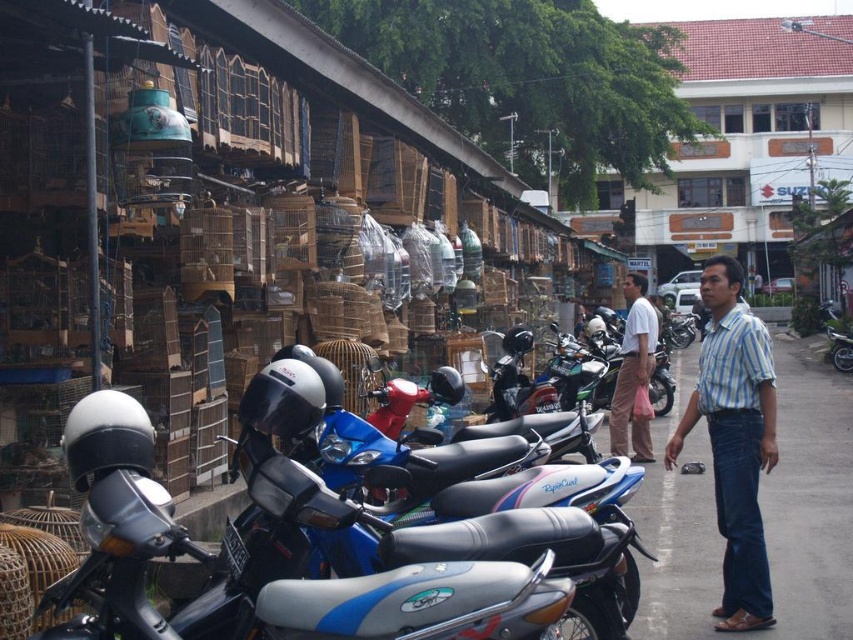
Question: Can you confirm if blue striped shirt at center is wider than white shirt at center?

Choices:
 (A) no
 (B) yes

Answer: (B)

Question: Which point appears closest to the camera in this image?

Choices:
 (A) (750, 342)
 (B) (641, 276)

Answer: (A)

Question: Is blue striped shirt at center in front of white shirt at center?

Choices:
 (A) no
 (B) yes

Answer: (B)

Question: Which of the following is the farthest from the observer?

Choices:
 (A) blue striped shirt at center
 (B) white shirt at center

Answer: (B)

Question: Does blue striped shirt at center appear over white shirt at center?

Choices:
 (A) yes
 (B) no

Answer: (B)